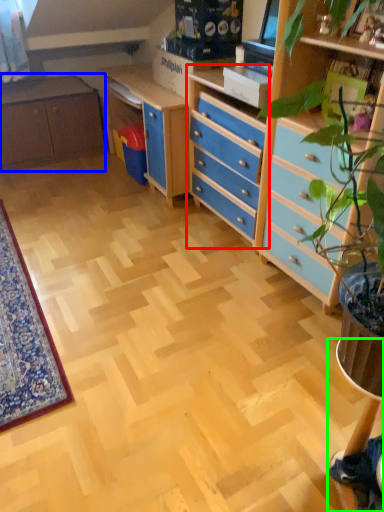
Question: Which object is the farthest from chest of drawers (highlighted by a red box)? Choose among these: cabinetry (highlighted by a blue box) or computer desk (highlighted by a green box).

Choices:
 (A) cabinetry
 (B) computer desk

Answer: (B)